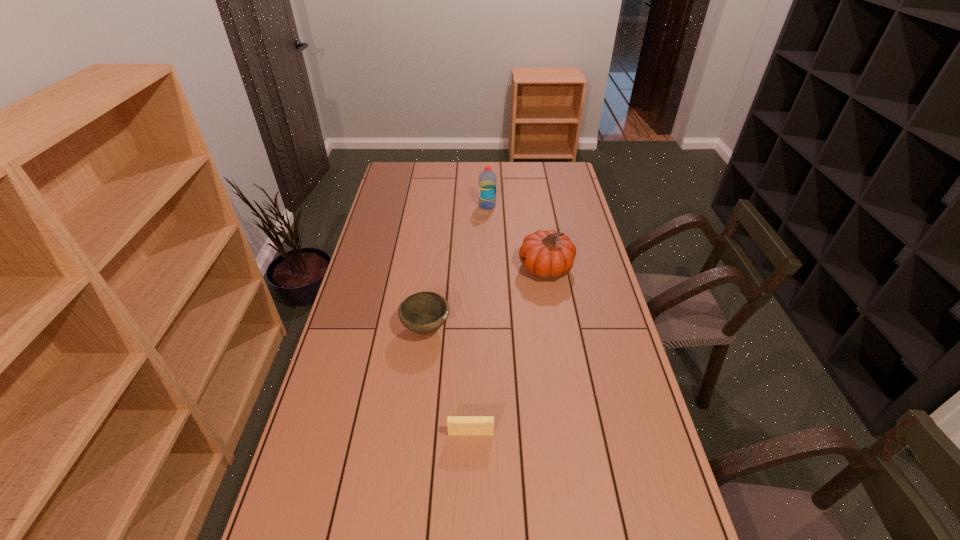
You are a GUI agent. You are given a task and a screenshot of the screen. Output one action in this format:
    pyautogui.click(x=<x>, y=<y>)
    Task: Click on the third closest object to the third farthest object
    Image resolution: width=960 pixels, height=540 pixels.
    Given the screenshot: What is the action you would take?
    (x=487, y=179)

Image resolution: width=960 pixels, height=540 pixels. I want to click on the second closest object to the shortest object, so click(547, 254).

You are a GUI agent. You are given a task and a screenshot of the screen. Output one action in this format:
    pyautogui.click(x=<x>, y=<y>)
    Task: Click on the free space that satisfies the following two spatial constraints: 1. on the face of the rightmost object; 2. at the front of the videotape with spools
    
    Given the screenshot: What is the action you would take?
    pyautogui.click(x=573, y=434)

Locate an element on the screen. The height and width of the screenshot is (540, 960). free spot that satisfies the following two spatial constraints: 1. on the face of the pumpkin; 2. at the front of the nearest object with spools is located at coordinates (573, 434).